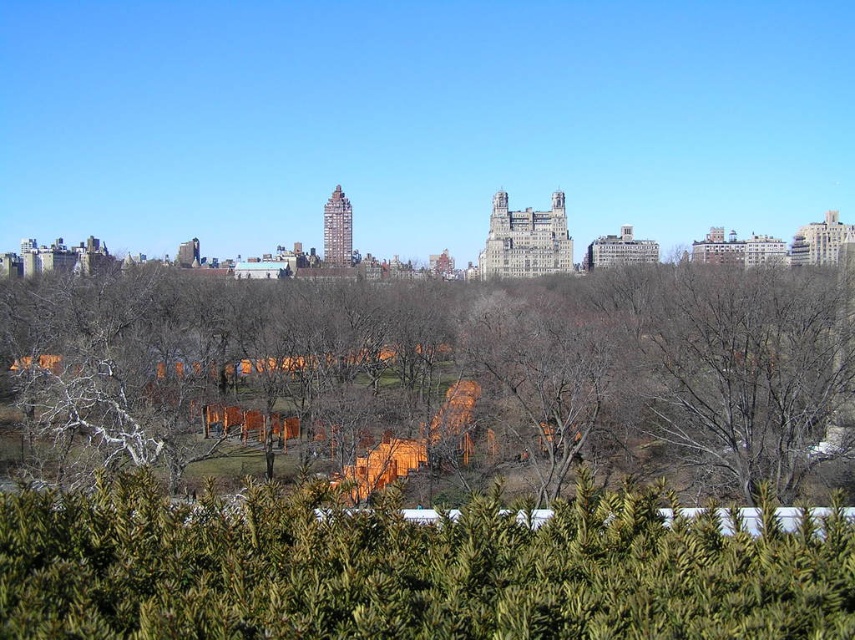
You are standing in the park and want to see what is behind the brown wood fence at center. Can you see the green textured hedge at lower center from your current position?

The green textured hedge at lower center is behind the brown wood fence at center, so it is obstructed and not visible from your current position.

You are standing in the park and want to find the brown wood fence at center. According to the coordinates provided, where should you look to locate it?

The brown wood fence at center is located at coordinates point (453,365).

You are standing in the park looking at the urban skyline. There are two points marked on the ground in front of you. The first point is at coordinates point (547, 337), and the second point is at point (136, 634). Which point is closer to you?

Point (136, 634) is closer to you because it is less further to the camera than point (547, 337).